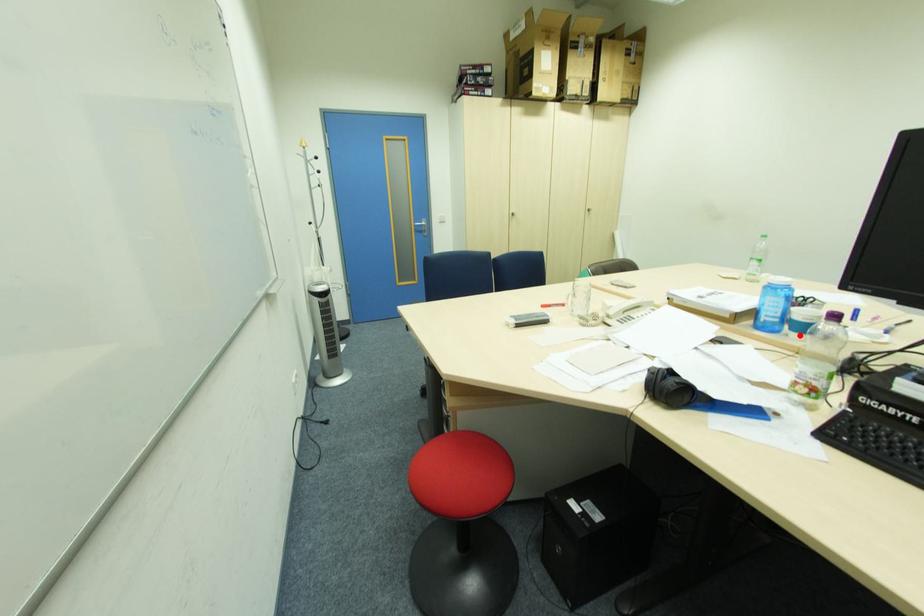
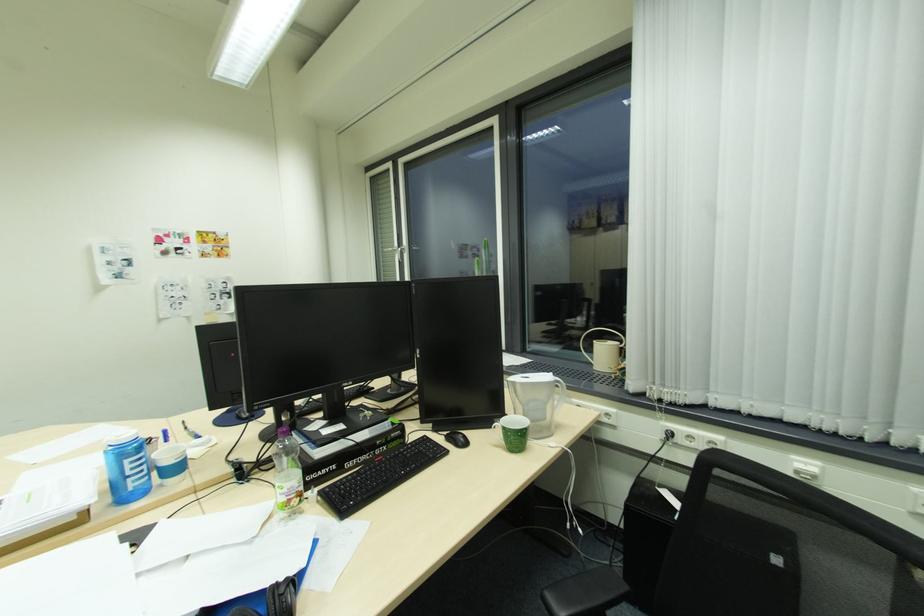
The point at the highlighted location is marked in the first image. Where is the corresponding point in the second image?

(176, 482)